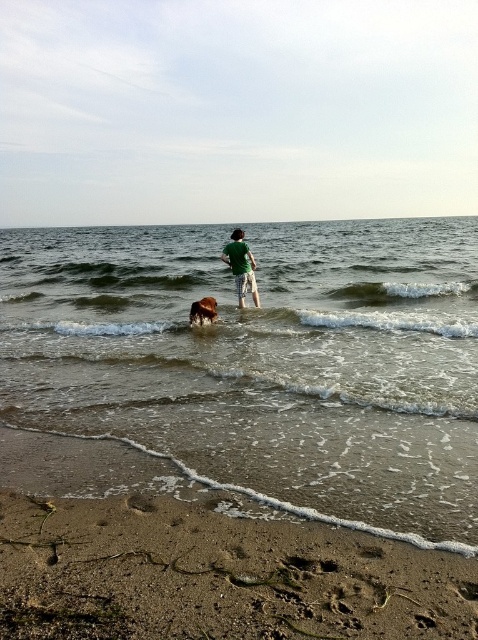
Question: Does clear water at center have a lesser width compared to brown sandy beach at lower left?

Choices:
 (A) no
 (B) yes

Answer: (A)

Question: Can you confirm if clear water at center is positioned to the right of brown furry dog at center?

Choices:
 (A) yes
 (B) no

Answer: (A)

Question: Which point appears closest to the camera in this image?

Choices:
 (A) (116, 321)
 (B) (235, 244)
 (C) (187, 534)
 (D) (213, 316)

Answer: (C)

Question: Based on their relative distances, which object is farther from the green matte shirt at center?

Choices:
 (A) clear water at center
 (B) brown furry dog at center
 (C) brown sandy beach at lower left

Answer: (A)

Question: Estimate the real-world distances between objects in this image. Which object is closer to the clear water at center?

Choices:
 (A) brown furry dog at center
 (B) brown sandy beach at lower left
 (C) green matte shirt at center

Answer: (B)

Question: Does brown sandy beach at lower left have a larger size compared to brown furry dog at center?

Choices:
 (A) no
 (B) yes

Answer: (B)